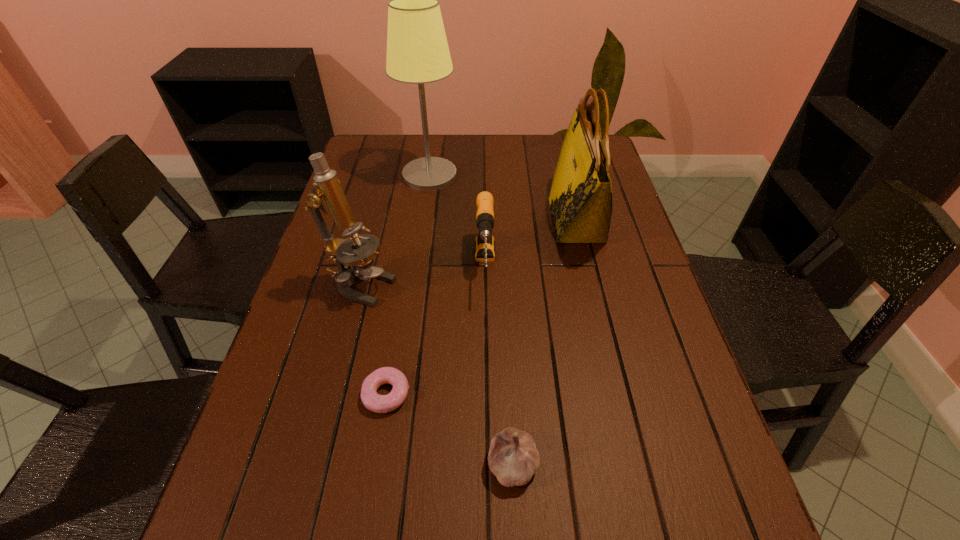
In the image, there is a desktop. Where is `vacant space at the left edge`? Image resolution: width=960 pixels, height=540 pixels. vacant space at the left edge is located at coordinates (303, 319).

The image size is (960, 540). I want to click on vacant area at the right edge, so click(636, 395).

You are a GUI agent. You are given a task and a screenshot of the screen. Output one action in this format:
    pyautogui.click(x=<x>, y=<y>)
    Task: Click on the free space between the second shortest object and the fifth farthest object
    
    Given the screenshot: What is the action you would take?
    pyautogui.click(x=449, y=429)

This screenshot has width=960, height=540. I want to click on vacant region between the fifth farthest object and the drill, so click(436, 330).

Image resolution: width=960 pixels, height=540 pixels. Find the location of `blank region between the rightmost object and the shortest object`. blank region between the rightmost object and the shortest object is located at coordinates (481, 307).

What are the coordinates of `vacant space in between the microscope and the tallest object` in the screenshot? It's located at (396, 231).

Identify the location of free spot between the doughnut and the fourth tallest object. (436, 330).

This screenshot has width=960, height=540. What are the coordinates of `free space between the shortest object and the second shortest object` in the screenshot? It's located at (449, 429).

Locate an element on the screen. Image resolution: width=960 pixels, height=540 pixels. empty space between the doughnut and the drill is located at coordinates (436, 330).

At what (x,y) coordinates should I click in order to perform the action: click on vacant space that's between the nearest object and the fourth tallest object. Please return your answer as a coordinate pair (x, y). The height and width of the screenshot is (540, 960). Looking at the image, I should click on (x=499, y=365).